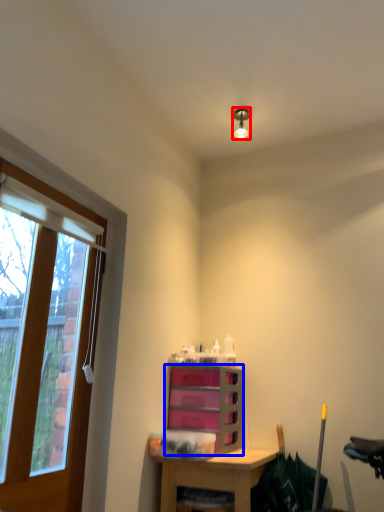
Question: Which object appears farthest to the camera in this image, light fixture (highlighted by a red box) or cabinetry (highlighted by a blue box)?

Choices:
 (A) light fixture
 (B) cabinetry

Answer: (A)